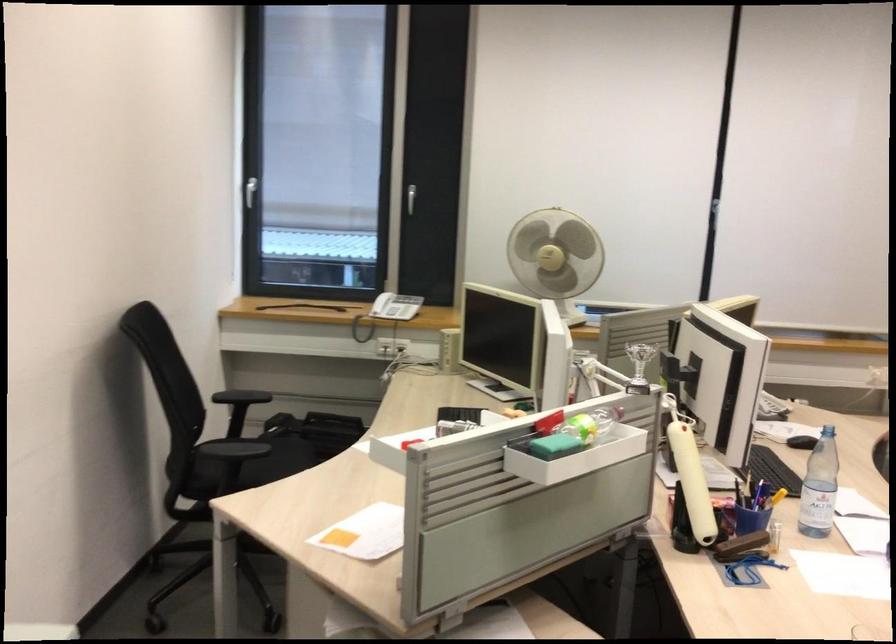
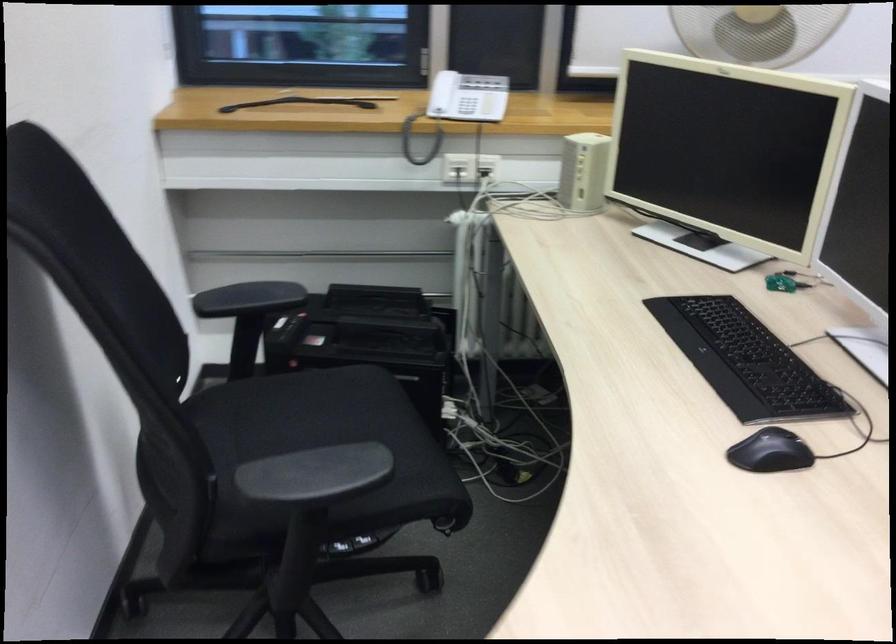
Locate, in the second image, the point that corresponds to pixel 388 308 in the first image.

(459, 106)